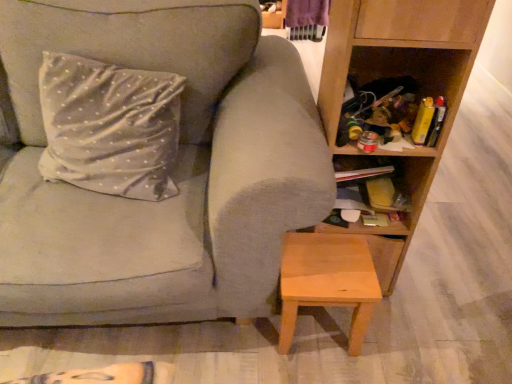
Question: Does light brown wooden stool at lower center have a greater height compared to wooden cabinet at lower right?

Choices:
 (A) yes
 (B) no

Answer: (A)

Question: Is light brown wooden stool at lower center far from wooden cabinet at lower right?

Choices:
 (A) yes
 (B) no

Answer: (B)

Question: Is the position of light brown wooden stool at lower center less distant than that of wooden cabinet at lower right?

Choices:
 (A) yes
 (B) no

Answer: (A)

Question: Can you confirm if light brown wooden stool at lower center is wider than wooden cabinet at lower right?

Choices:
 (A) no
 (B) yes

Answer: (B)

Question: Is light brown wooden stool at lower center thinner than wooden cabinet at lower right?

Choices:
 (A) no
 (B) yes

Answer: (A)

Question: Considering the positions of matte gray couch at center and light brown wooden stool at lower center in the image, is matte gray couch at center bigger or smaller than light brown wooden stool at lower center?

Choices:
 (A) small
 (B) big

Answer: (B)

Question: Considering the positions of matte gray couch at center and light brown wooden stool at lower center in the image, is matte gray couch at center taller or shorter than light brown wooden stool at lower center?

Choices:
 (A) tall
 (B) short

Answer: (A)

Question: From a real-world perspective, is matte gray couch at center physically located above or below light brown wooden stool at lower center?

Choices:
 (A) below
 (B) above

Answer: (B)

Question: In the image, is matte gray couch at center positioned in front of or behind light brown wooden stool at lower center?

Choices:
 (A) front
 (B) behind

Answer: (A)

Question: Is light brown wooden stool at lower center inside or outside of wooden cabinet at lower right?

Choices:
 (A) inside
 (B) outside

Answer: (B)

Question: In terms of width, does light brown wooden stool at lower center look wider or thinner when compared to wooden cabinet at lower right?

Choices:
 (A) wide
 (B) thin

Answer: (A)

Question: In terms of size, does light brown wooden stool at lower center appear bigger or smaller than wooden cabinet at lower right?

Choices:
 (A) big
 (B) small

Answer: (A)

Question: Is point (360, 334) positioned closer to the camera than point (409, 223)?

Choices:
 (A) farther
 (B) closer

Answer: (B)

Question: Looking at the image, does wooden cabinet at lower right seem bigger or smaller compared to silky silver pillow at upper left?

Choices:
 (A) small
 (B) big

Answer: (A)

Question: Looking at their shapes, would you say wooden cabinet at lower right is wider or thinner than silky silver pillow at upper left?

Choices:
 (A) wide
 (B) thin

Answer: (A)